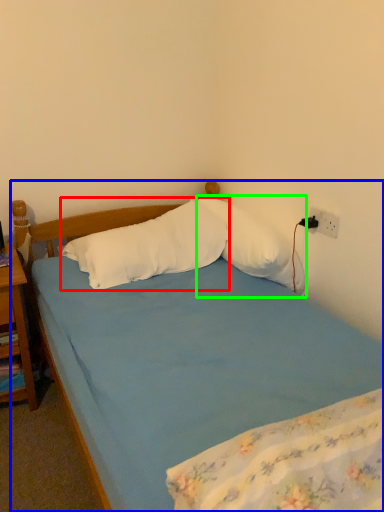
Question: Which object is positioned closest to pillow (highlighted by a red box)? Select from bed (highlighted by a blue box) and pillow (highlighted by a green box).

Choices:
 (A) bed
 (B) pillow

Answer: (A)